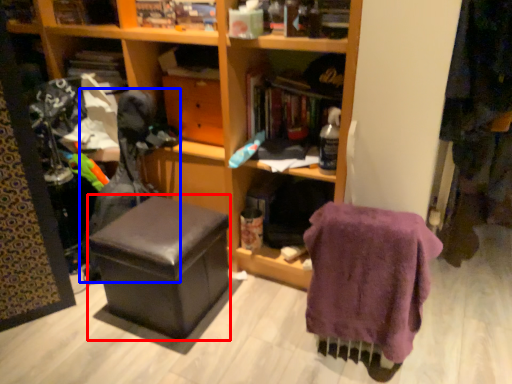
Question: Which of the following is the closest to the observer, stool (highlighted by a red box) or swivel chair (highlighted by a blue box)?

Choices:
 (A) stool
 (B) swivel chair

Answer: (A)